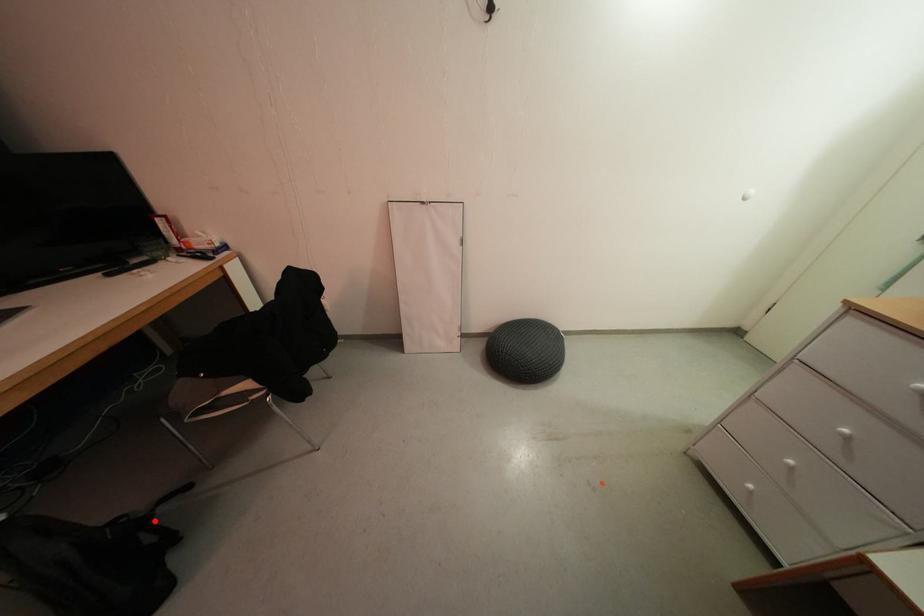
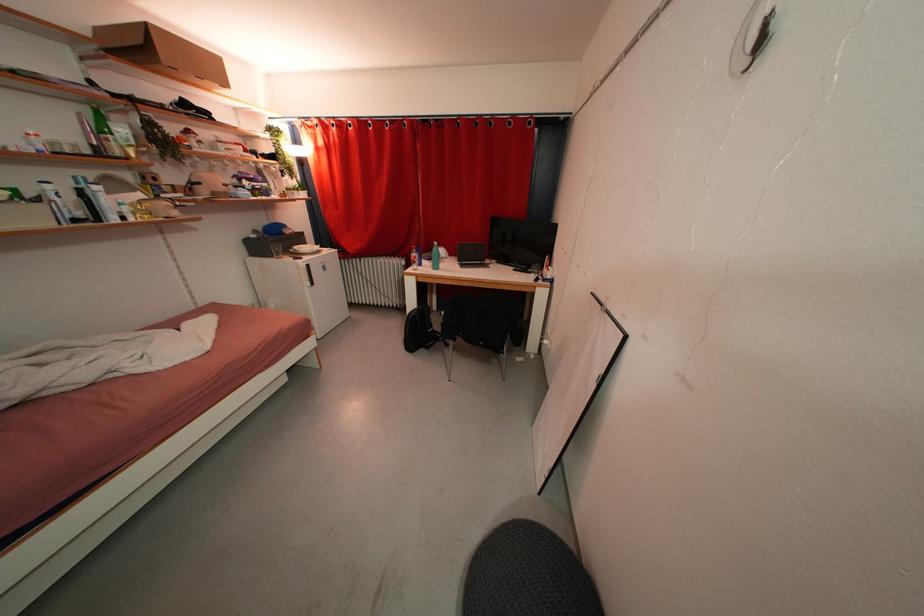
Question: A red point is marked in image1. In image2, is the corresponding 3D point closer to the camera or farther? Reply with the corresponding letter.

Choices:
 (A) The corresponding 3D point is closer.
 (B) The corresponding 3D point is farther.

Answer: (B)